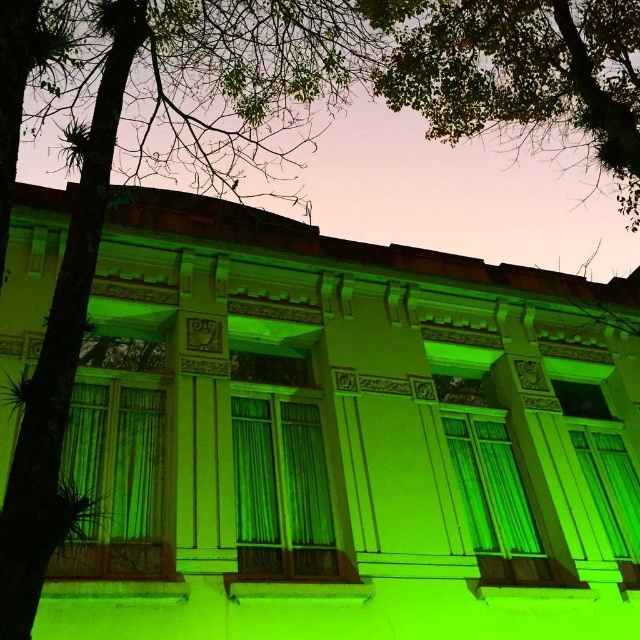
You are an interior designer assessing the space. You need to determine which object between the green leafy tree at upper center and the green fabric curtain at center has a narrower width. Which one is it?

The green leafy tree at upper center is thinner than the green fabric curtain at center, so the green leafy tree at upper center has a narrower width.

You are standing at the base of the classical building and want to walk towards the point labeled as point [627,532]. If you continue moving in that direction, will you pass by the point labeled as point [612,29] first?

Since point [612,29] is behind point [627,532], you will reach point [627,532] first before encountering point [612,29].

You are standing in front of the classical building and want to take a photo that includes both the green leafy tree at upper center and the green fabric curtain at center. Which object should you focus on first to ensure both are in clear view?

You should focus on the green leafy tree at upper center first because it is closer to you than the green fabric curtain at center, so focusing on it will keep both objects in clear view.